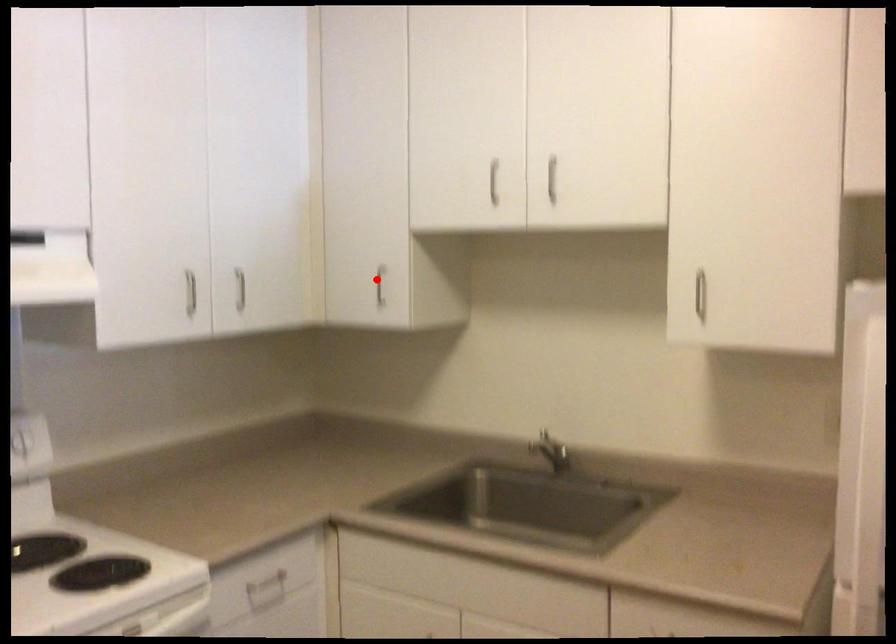
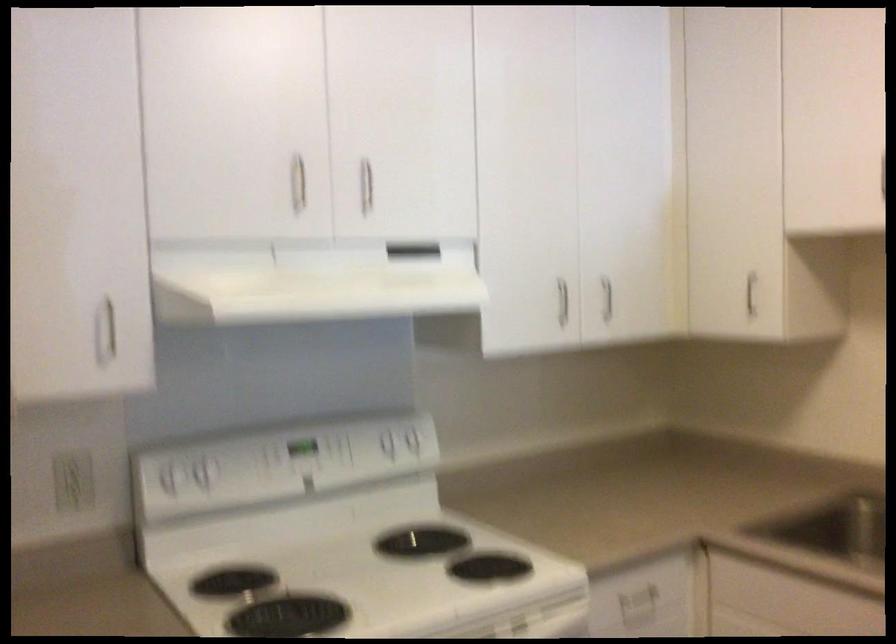
The point at the highlighted location is marked in the first image. Where is the corresponding point in the second image?

(751, 292)